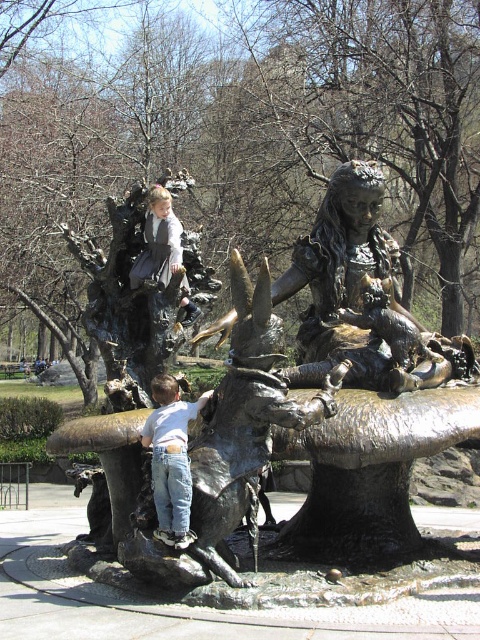
Does bronze statue at center have a lesser height compared to white matte shirt at lower center?

No.

Image resolution: width=480 pixels, height=640 pixels. Find the location of `bronze statue at center`. bronze statue at center is located at coordinates (301, 413).

Does point (216, 492) come behind point (158, 483)?

No, (216, 492) is in front of (158, 483).

Locate an element on the screen. bronze statue at center is located at coordinates (301, 413).

Is white matte shirt at lower center positioned before matte bronze statue at center?

Yes, it is in front of matte bronze statue at center.

Can you confirm if white matte shirt at lower center is positioned above matte bronze statue at center?

No, white matte shirt at lower center is not above matte bronze statue at center.

Where is `white matte shirt at lower center`? Image resolution: width=480 pixels, height=640 pixels. white matte shirt at lower center is located at coordinates (170, 460).

The height and width of the screenshot is (640, 480). I want to click on white matte shirt at lower center, so click(x=170, y=460).

Between point (120, 456) and point (173, 241), which one is positioned behind?

Positioned behind is point (173, 241).

Can you confirm if bronze statue at center is smaller than matte bronze statue at center?

Incorrect, bronze statue at center is not smaller in size than matte bronze statue at center.

Which is behind, point (411, 460) or point (166, 202)?

The point (166, 202) is behind.

At what (x,y) coordinates should I click in order to perform the action: click on bronze statue at center. Please return your answer as a coordinate pair (x, y). Looking at the image, I should click on (301, 413).